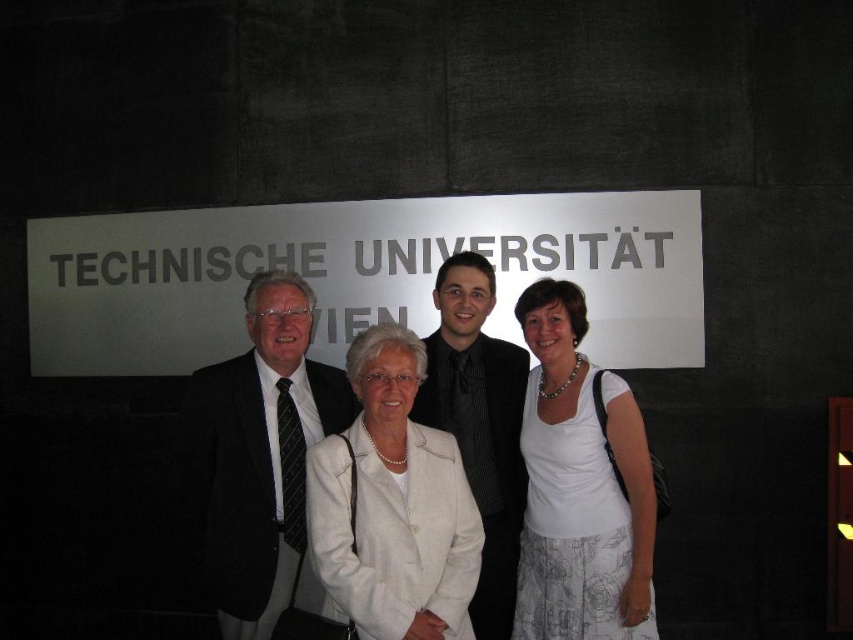
Question: Is dark suit at center closer to the viewer compared to white fabric skirt at center?

Choices:
 (A) no
 (B) yes

Answer: (A)

Question: Does dark suit at center have a lesser width compared to black textured suit at center?

Choices:
 (A) yes
 (B) no

Answer: (B)

Question: Which is farther from the white fabric coat at center?

Choices:
 (A) white fabric skirt at center
 (B) dark suit at center
 (C) black textured suit at center

Answer: (A)

Question: Which object is positioned farthest from the black textured suit at center?

Choices:
 (A) white fabric coat at center
 (B) white fabric skirt at center
 (C) dark suit at center

Answer: (C)

Question: Observing the image, what is the correct spatial positioning of white fabric skirt at center in reference to white fabric coat at center?

Choices:
 (A) right
 (B) left

Answer: (A)

Question: Which of these objects is positioned farthest from the dark suit at center?

Choices:
 (A) white fabric skirt at center
 (B) black textured suit at center
 (C) white fabric coat at center

Answer: (A)